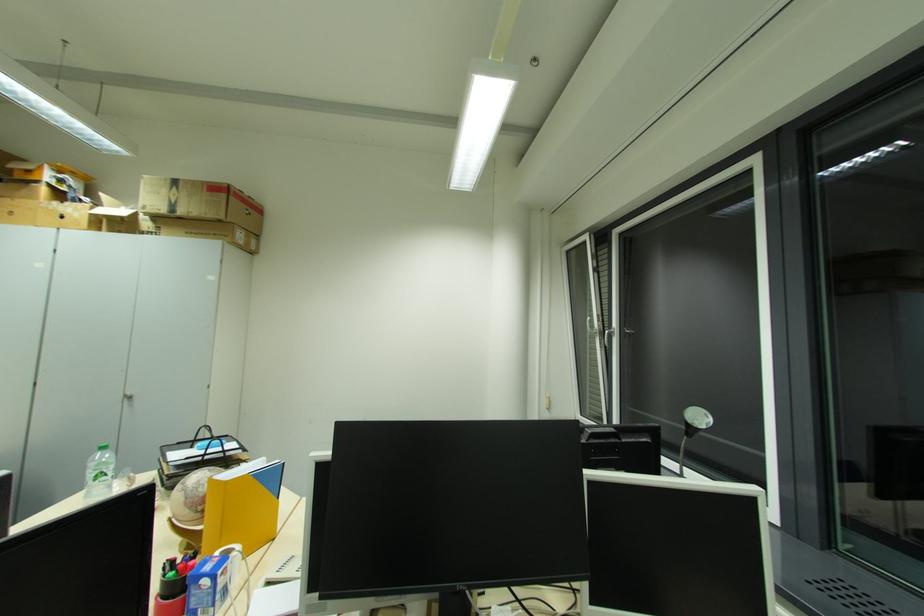
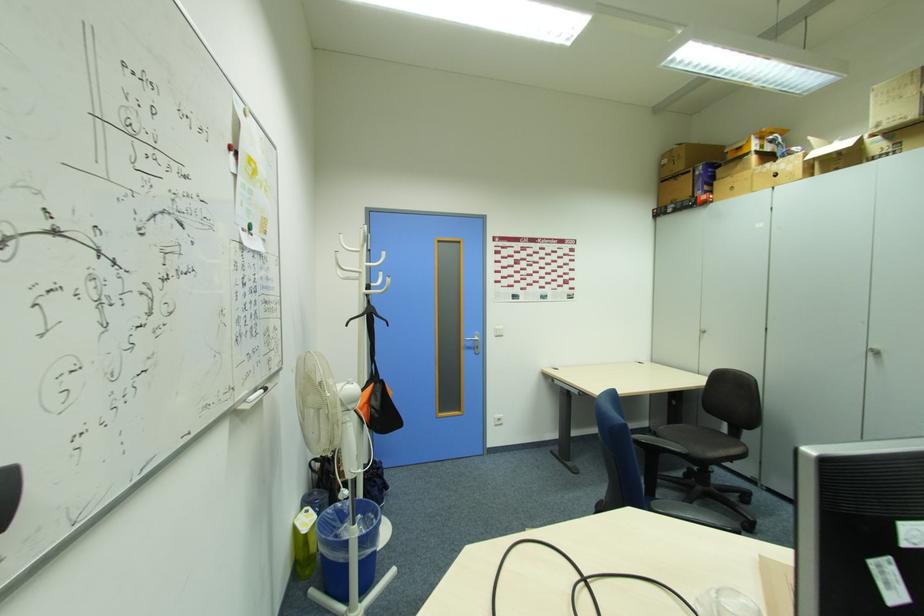
Question: Based on the continuous images, in which direction is the camera rotating? Reply with the corresponding letter.

Choices:
 (A) Left
 (B) Right
 (C) Up
 (D) Down

Answer: (A)